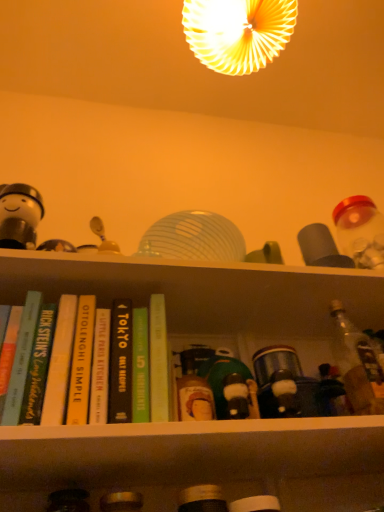
Question: Which direction should I rotate to look at black hardcover book at center, the 2th book viewed from the right?

Choices:
 (A) left
 (B) right

Answer: (A)

Question: From the image's perspective, would you say white matte figurine at left is shown under hardcover book at left, the fourth book from the right?

Choices:
 (A) no
 (B) yes

Answer: (A)

Question: Is white matte figurine at left shorter than hardcover book at left, arranged as the second book when viewed from the left?

Choices:
 (A) no
 (B) yes

Answer: (B)

Question: Is white matte figurine at left located outside hardcover book at left, arranged as the second book when viewed from the left?

Choices:
 (A) yes
 (B) no

Answer: (A)

Question: Does white matte figurine at left have a greater width compared to hardcover book at left, the fourth book from the right?

Choices:
 (A) no
 (B) yes

Answer: (A)

Question: Is white matte figurine at left at the left side of hardcover book at left, the fourth book from the right?

Choices:
 (A) yes
 (B) no

Answer: (A)

Question: Is white matte figurine at left thinner than hardcover book at left, the fourth book from the right?

Choices:
 (A) yes
 (B) no

Answer: (A)

Question: Is clear glass bottle at right, the first bottle positioned from the top, located outside black hardcover book at center, which is the fourth book in left-to-right order?

Choices:
 (A) no
 (B) yes

Answer: (B)

Question: From the image's perspective, is clear glass bottle at right, the 3th bottle positioned from the left, on black hardcover book at center, which is the fourth book in left-to-right order?

Choices:
 (A) yes
 (B) no

Answer: (A)

Question: Is clear glass bottle at right, which is the third bottle from bottom to top, next to black hardcover book at center, the 2th book viewed from the right, and touching it?

Choices:
 (A) yes
 (B) no

Answer: (B)

Question: From a real-world perspective, is clear glass bottle at right, placed as the 1th bottle when sorted from right to left, located beneath black hardcover book at center, which is the fourth book in left-to-right order?

Choices:
 (A) no
 (B) yes

Answer: (B)

Question: From a real-world perspective, is clear glass bottle at right, which is the third bottle from bottom to top, over black hardcover book at center, the 2th book viewed from the right?

Choices:
 (A) yes
 (B) no

Answer: (B)

Question: Does hardcover book at left, which appears as the 5th book when viewed from the right, have a smaller size compared to matte yellow lampshade at upper center?

Choices:
 (A) yes
 (B) no

Answer: (A)